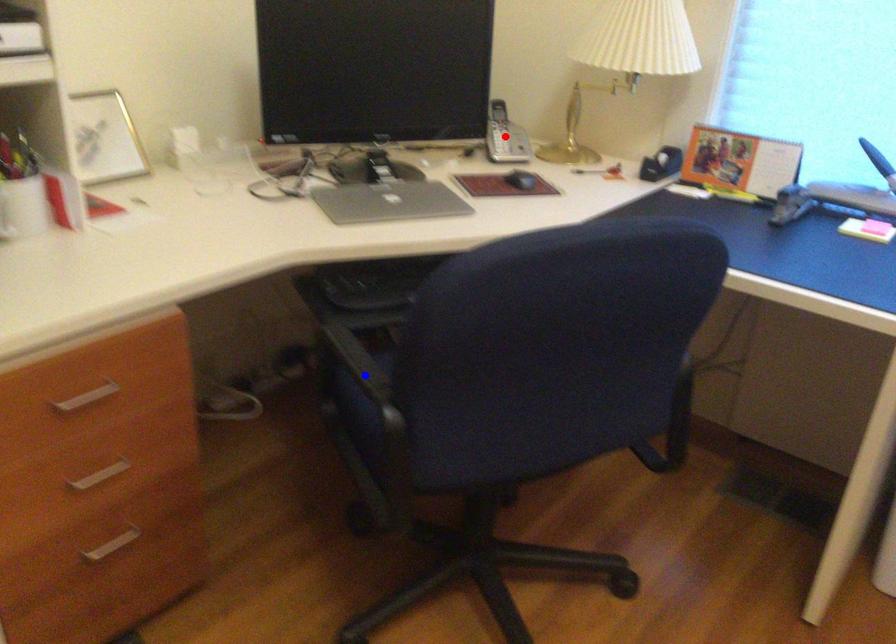
Question: Which of the two points in the image is closer to the camera?

Choices:
 (A) Blue point is closer.
 (B) Red point is closer.

Answer: (A)